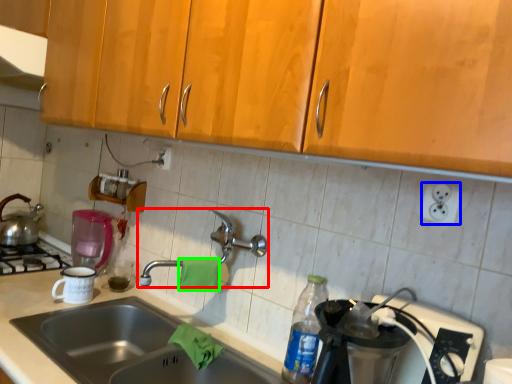
Question: Based on their relative distances, which object is nearer to tap (highlighted by a red box)? Choose from electric outlet (highlighted by a blue box) and material (highlighted by a green box).

Choices:
 (A) electric outlet
 (B) material

Answer: (B)